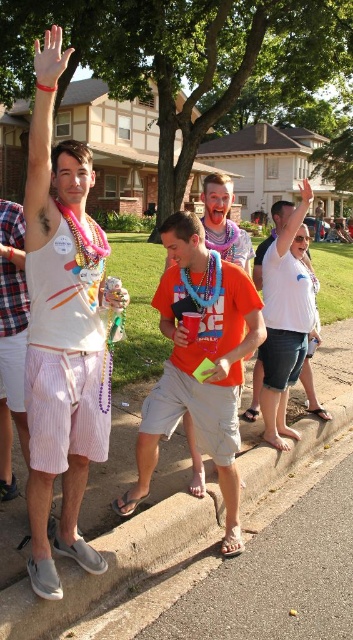
Question: Among these points, which one is nearest to the camera?

Choices:
 (A) (219, 372)
 (B) (10, 324)
 (C) (118, 296)

Answer: (C)

Question: Where is white cotton t-shirt at center located in relation to blue beaded necklace at center in the image?

Choices:
 (A) right
 (B) left

Answer: (A)

Question: Among these objects, which one is farthest from the camera?

Choices:
 (A) white cotton t-shirt at center
 (B) metallic silver can at center
 (C) matte plastic hand at upper center
 (D) orange cotton t-shirt at center

Answer: (C)

Question: Does metallic silver can at center have a lesser width compared to matte plastic hand at upper center?

Choices:
 (A) yes
 (B) no

Answer: (A)

Question: Can you confirm if matte white tank top at upper left is positioned below white matte hand at upper left?

Choices:
 (A) yes
 (B) no

Answer: (A)

Question: Which object appears farthest from the camera in this image?

Choices:
 (A) orange cotton t-shirt at center
 (B) white cotton t-shirt at center
 (C) multicolored beads at left

Answer: (B)